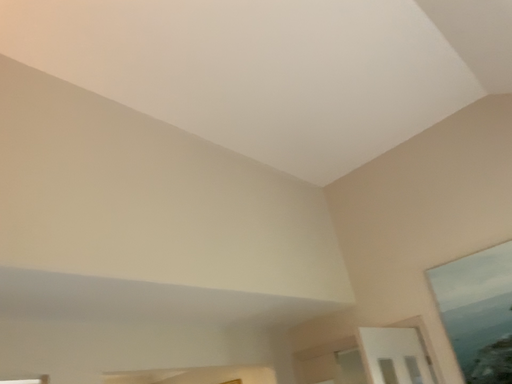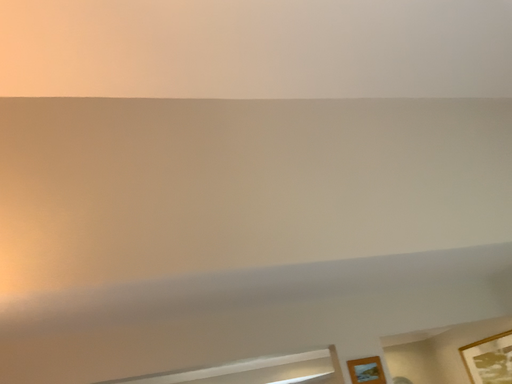
Question: How did the camera likely rotate when shooting the video?

Choices:
 (A) rotated left
 (B) rotated right

Answer: (A)